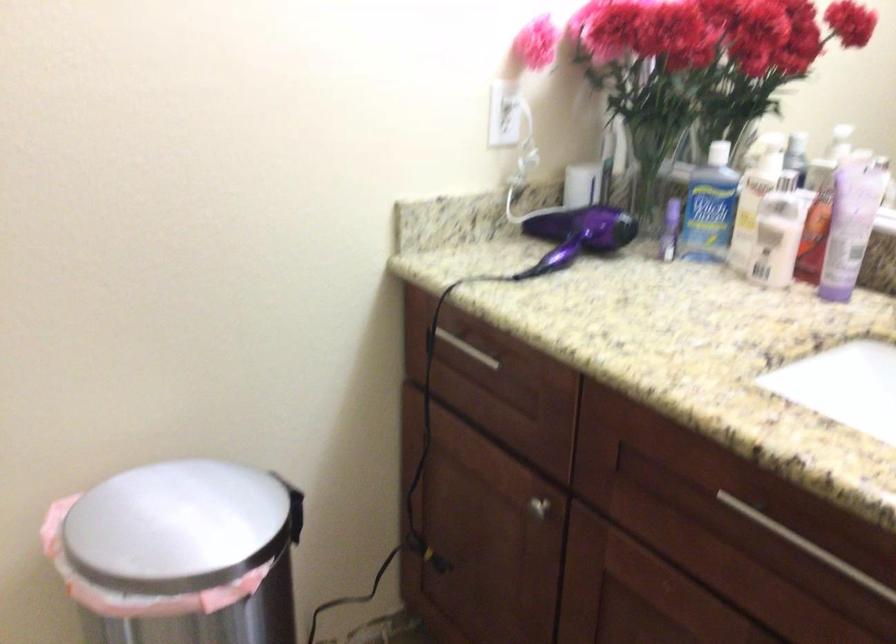
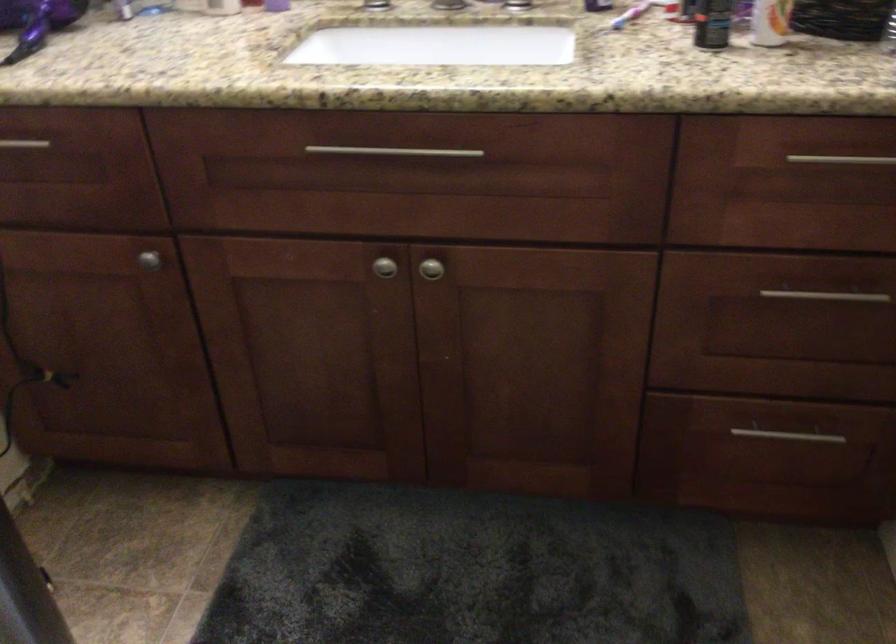
Where in the second image is the point corresponding to pixel 564 239 from the first image?

(37, 22)